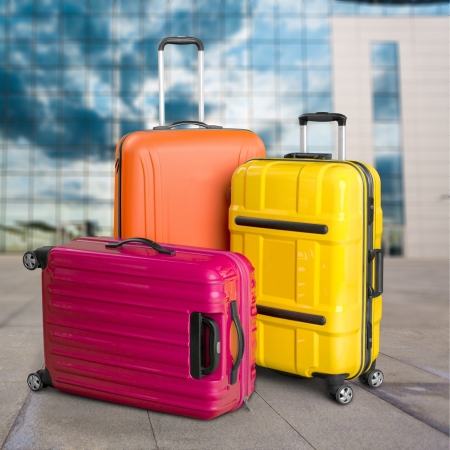
Where is `black handles`? Image resolution: width=450 pixels, height=450 pixels. black handles is located at coordinates (140, 239), (236, 305), (378, 279), (337, 113), (192, 122), (315, 153), (215, 359).